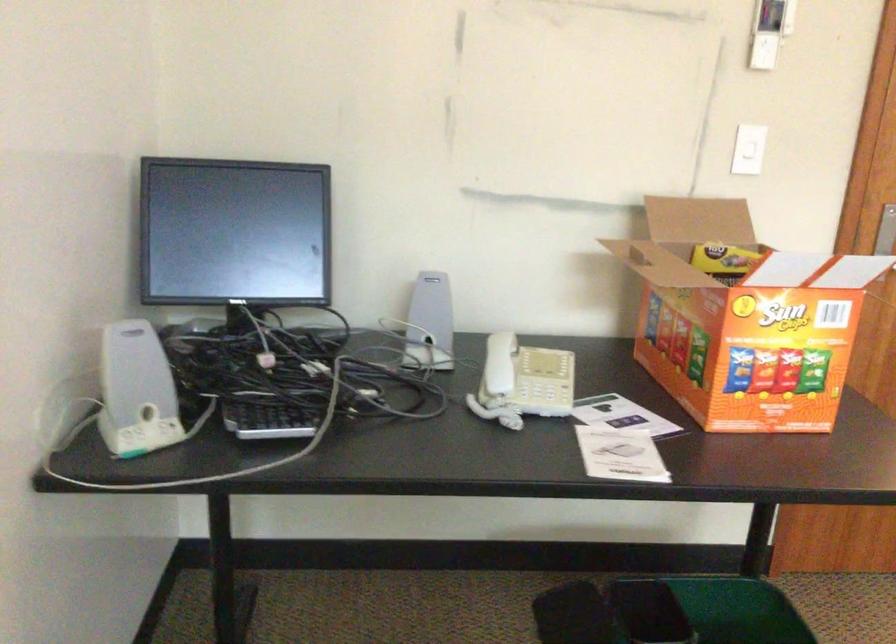
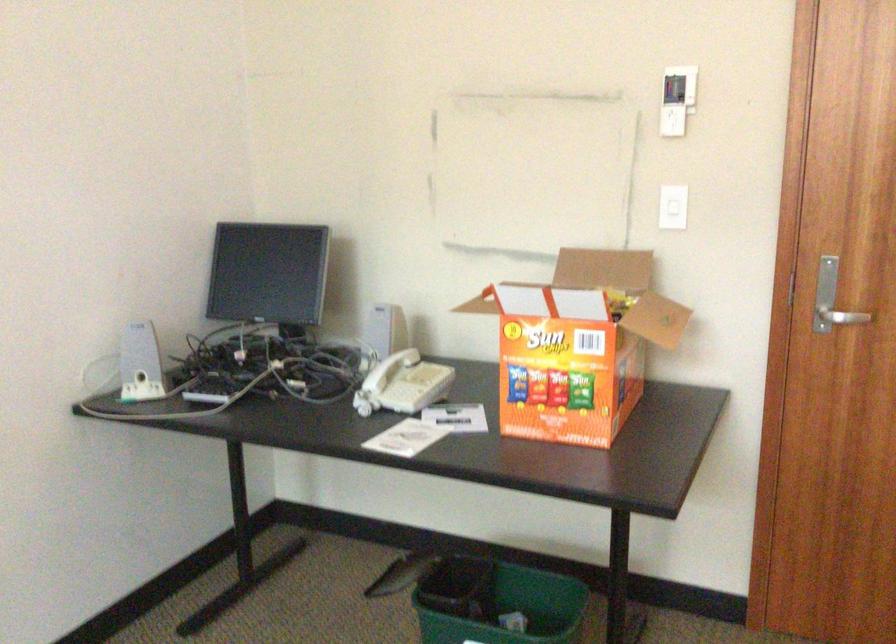
Locate, in the second image, the point that corresponds to point (433, 308) in the first image.

(384, 328)